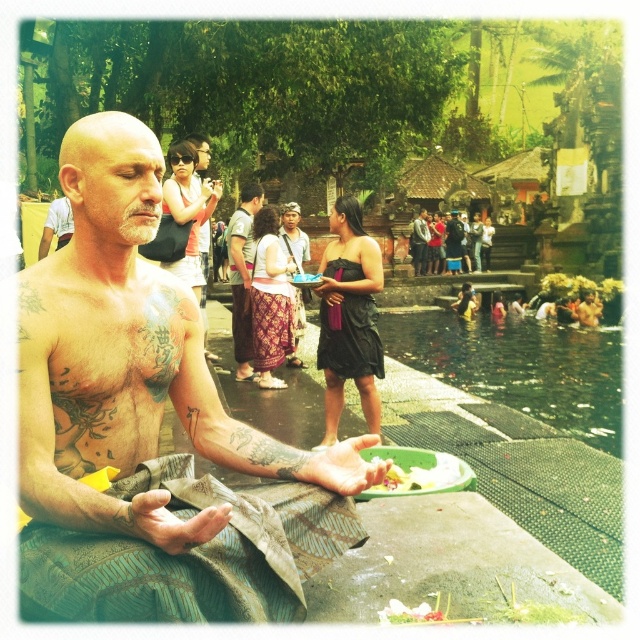
Question: Which point is closer to the camera?

Choices:
 (A) yellow flower petals at lower center
 (B) dark brown leather bag at center

Answer: (A)

Question: Which object is the farthest from the bald head at center?

Choices:
 (A) dark brown leather sandals at center
 (B) patterned fabric skirt at center

Answer: (A)

Question: Observing the image, what is the correct spatial positioning of bald head at center in reference to dark brown leather bag at center?

Choices:
 (A) below
 (B) above

Answer: (A)

Question: Is bald head at center further to camera compared to dark brown leather bag at center?

Choices:
 (A) no
 (B) yes

Answer: (A)

Question: Estimate the real-world distances between objects in this image. Which object is farther from the dark brown leather bag at center?

Choices:
 (A) dark brown leather sandals at center
 (B) patterned fabric sarong at center
 (C) shiny metallic cloth at center

Answer: (C)

Question: Does clear water at pool right have a lesser width compared to dark brown leather bag at center?

Choices:
 (A) yes
 (B) no

Answer: (B)